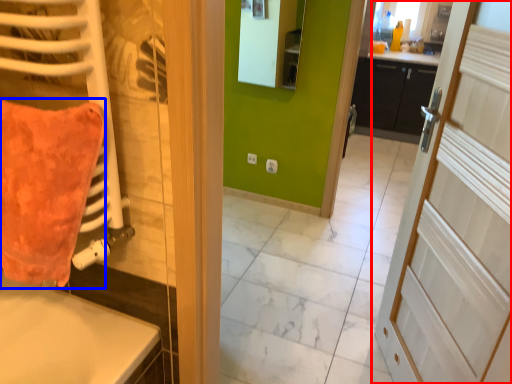
Question: Which of the following is the closest to the observer, door (highlighted by a red box) or throw pillow (highlighted by a blue box)?

Choices:
 (A) door
 (B) throw pillow

Answer: (A)